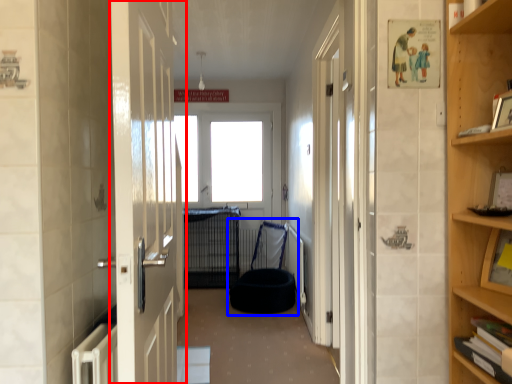
Question: Among these objects, which one is nearest to the camera, door (highlighted by a red box) or bean bag chair (highlighted by a blue box)?

Choices:
 (A) door
 (B) bean bag chair

Answer: (A)